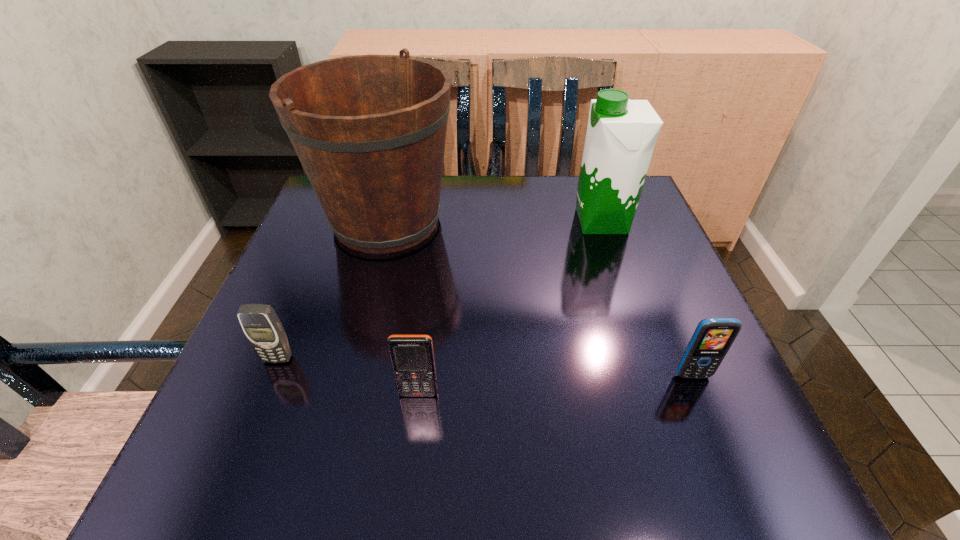
Identify the location of vacant area between the farthest cellular telephone and the second nearest cellular telephone. (486, 367).

At what (x,y) coordinates should I click in order to perform the action: click on free space between the second farthest cellular telephone and the soya milk. Please return your answer as a coordinate pair (x, y). The image size is (960, 540). Looking at the image, I should click on (647, 299).

The height and width of the screenshot is (540, 960). I want to click on free space between the second cellular telephone from left to right and the fourth farthest object, so click(x=556, y=384).

You are a GUI agent. You are given a task and a screenshot of the screen. Output one action in this format:
    pyautogui.click(x=<x>, y=<y>)
    Task: Click on the free spot between the second cellular telephone from left to right and the soya milk
    The height and width of the screenshot is (540, 960).
    Given the screenshot: What is the action you would take?
    pyautogui.click(x=510, y=307)

Locate an element on the screen. The image size is (960, 540). free space that is in between the bucket and the third farthest object is located at coordinates (332, 290).

The image size is (960, 540). I want to click on vacant area that lies between the farthest cellular telephone and the bucket, so click(332, 290).

What are the coordinates of `free space between the leftmost cellular telephone and the soya milk` in the screenshot? It's located at (440, 290).

Image resolution: width=960 pixels, height=540 pixels. I want to click on unoccupied area between the nearest cellular telephone and the soya milk, so click(510, 307).

In order to click on object that is the nearest to the bucket in this screenshot , I will do `click(260, 323)`.

The image size is (960, 540). I want to click on object identified as the second closest to the third nearest object, so click(369, 130).